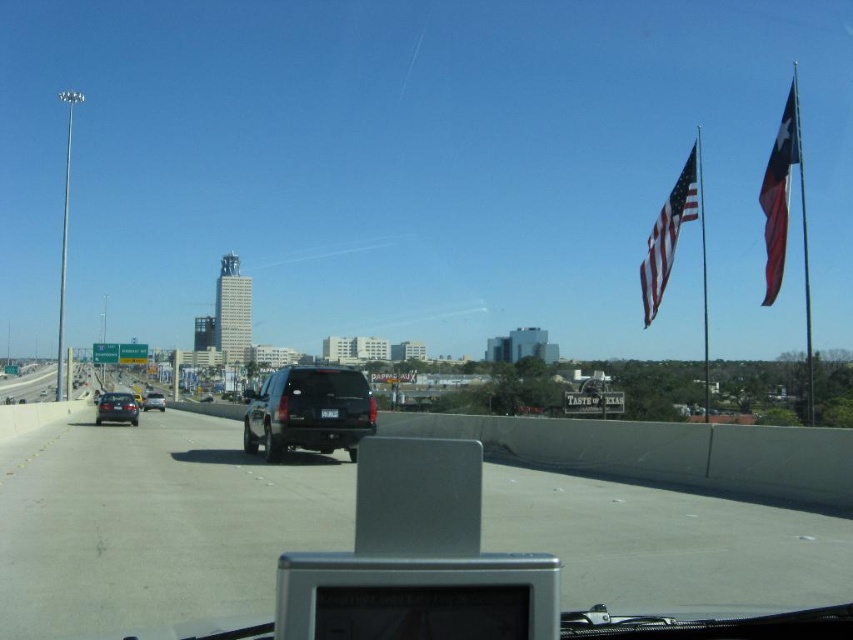
You are driving a car and looking at the road ahead. You notice two sections of the black asphalt highway at center and the black asphalt highway at left. Which section of the highway appears larger in the view from your car?

The black asphalt highway at center appears larger than the black asphalt highway at left.

You are a passenger in the vehicle and looking out the windshield. From your perspective, which vehicle is positioned higher between the black matte suv at center and the black matte sedan at left?

The black matte suv at center is positioned higher than the black matte sedan at left because it is located above it in the image.